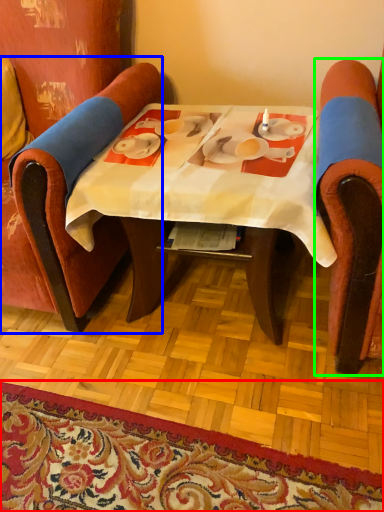
Question: Which object is the closest to the mat (highlighted by a red box)? Choose among these: chair (highlighted by a blue box) or chair (highlighted by a green box).

Choices:
 (A) chair
 (B) chair

Answer: (A)